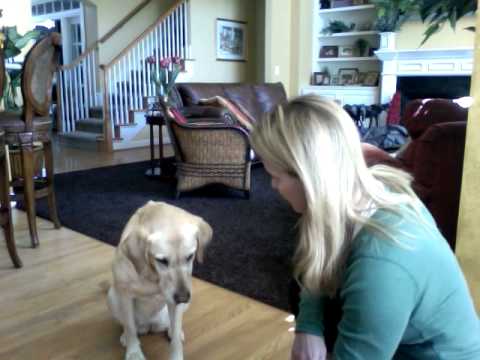
This screenshot has height=360, width=480. Find the location of `stair steps`. stair steps is located at coordinates (87, 132), (87, 120), (95, 108), (112, 97), (126, 83), (134, 71), (140, 59), (155, 49).